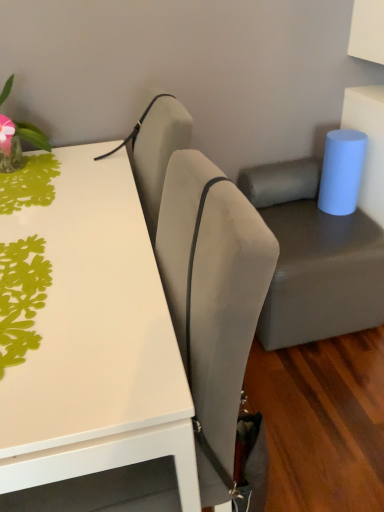
Question: Based on their positions, is suede-like beige armchair at upper center located to the left or right of white glossy table at upper left?

Choices:
 (A) right
 (B) left

Answer: (A)

Question: From the image's perspective, is suede-like beige armchair at upper center positioned above or below white glossy table at upper left?

Choices:
 (A) below
 (B) above

Answer: (B)

Question: Which object is positioned closest to the green paper cutout at upper left, acting as the first plant starting from the front?

Choices:
 (A) suede-like beige chair at center
 (B) green matte vase at upper left, the second plant from the front
 (C) suede-like beige armchair at upper center
 (D) matte gray swivel chair at center
 (E) white glossy table at upper left

Answer: (E)

Question: Estimate the real-world distances between objects in this image. Which object is farther from the suede-like beige armchair at upper center?

Choices:
 (A) suede-like beige chair at center
 (B) white glossy table at upper left
 (C) green matte vase at upper left, the second plant from the front
 (D) green paper cutout at upper left, the first plant when ordered from bottom to top
 (E) matte gray swivel chair at center

Answer: (E)